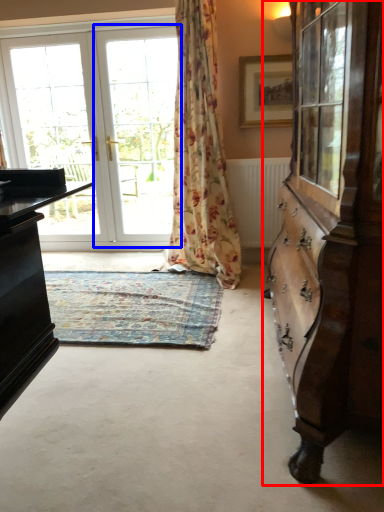
Question: Among these objects, which one is farthest to the camera, cabinetry (highlighted by a red box) or screen door (highlighted by a blue box)?

Choices:
 (A) cabinetry
 (B) screen door

Answer: (B)